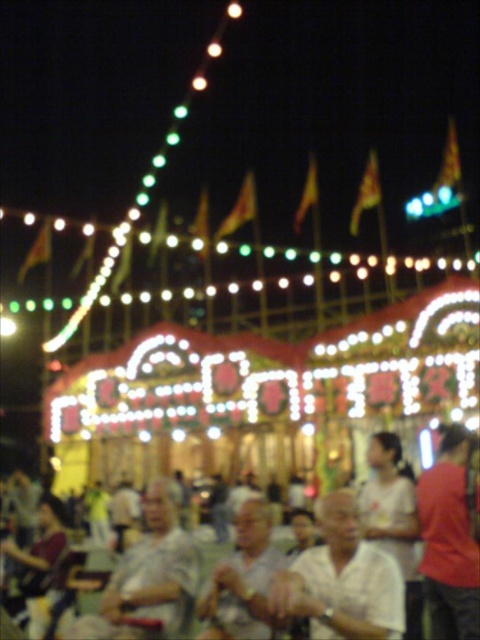
Question: Based on their relative distances, which object is farther from the white textured shirt at center?

Choices:
 (A) gray fabric shirt at lower left
 (B) white matte shirt at center

Answer: (A)

Question: Where is gray fabric shirt at lower left located in relation to white textured shirt at center in the image?

Choices:
 (A) below
 (B) above

Answer: (A)

Question: Which of the following is the farthest from the observer?

Choices:
 (A) white matte shirt at center
 (B) gray fabric shirt at lower left
 (C) white textured shirt at center
 (D) red fabric shirt at right

Answer: (B)

Question: Can you confirm if white matte shirt at center is positioned above white textured shirt at center?

Choices:
 (A) no
 (B) yes

Answer: (B)

Question: Observing the image, what is the correct spatial positioning of white matte shirt at center in reference to red fabric shirt at right?

Choices:
 (A) right
 (B) left

Answer: (B)

Question: Among these points, which one is farthest from the camera?

Choices:
 (A) (468, 516)
 (B) (392, 605)
 (C) (139, 609)

Answer: (A)